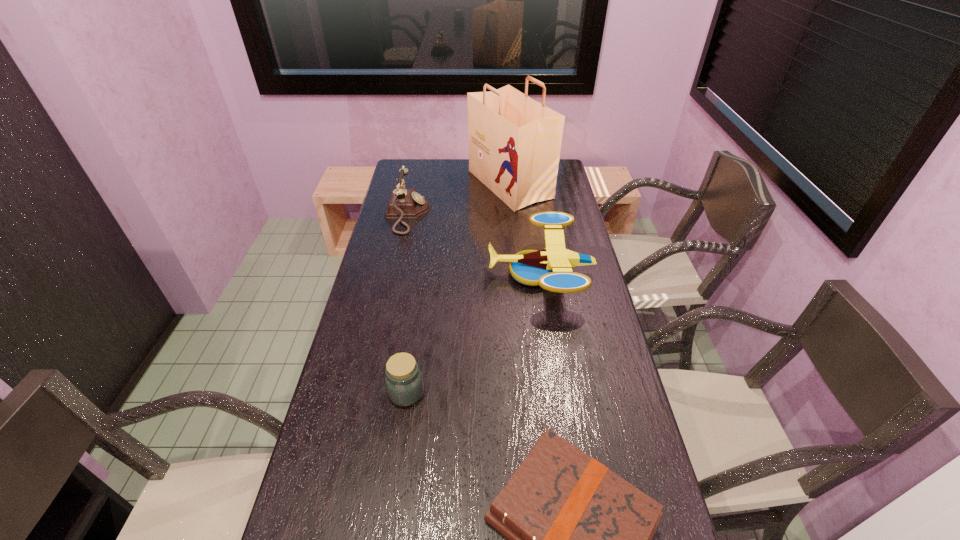
This screenshot has height=540, width=960. I want to click on free location located 0.130m at the cockpit of the drone, so click(x=450, y=273).

Image resolution: width=960 pixels, height=540 pixels. I want to click on vacant area situated at the cockpit of the drone, so click(x=433, y=273).

The width and height of the screenshot is (960, 540). I want to click on object positioned at the far edge, so click(514, 141).

Where is `telephone present at the left edge`? telephone present at the left edge is located at coordinates (404, 203).

Find the location of a particular element. jar at the left edge is located at coordinates (404, 383).

Where is `grocery bag present at the right edge`? grocery bag present at the right edge is located at coordinates (514, 141).

Find the location of a particular element. drone present at the right edge is located at coordinates (551, 268).

This screenshot has height=540, width=960. I want to click on object that is at the far right corner, so click(x=514, y=141).

Find the location of a particular element. free region at the left edge is located at coordinates (321, 449).

This screenshot has height=540, width=960. In the image, there is a desktop. In order to click on vacant space at the right edge in this screenshot , I will do [x=543, y=242].